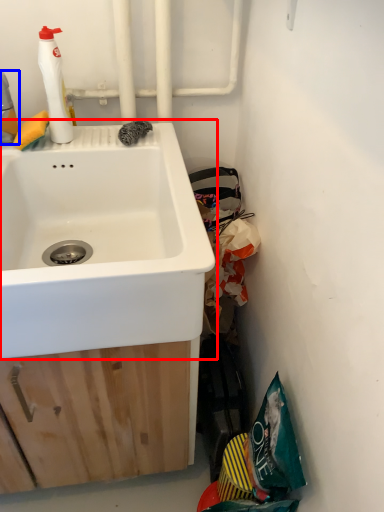
Question: Which object is closer to the camera taking this photo, sink (highlighted by a red box) or cleaning product (highlighted by a blue box)?

Choices:
 (A) sink
 (B) cleaning product

Answer: (A)